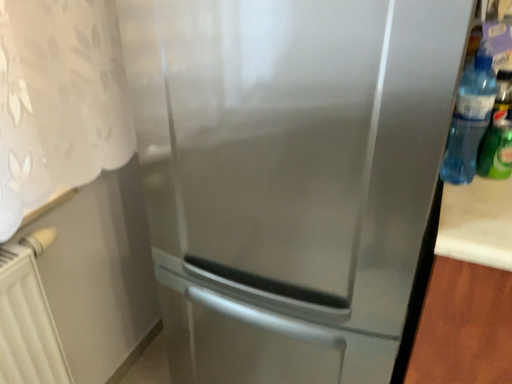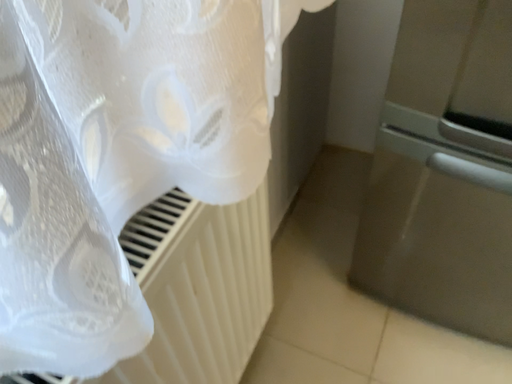
Question: How did the camera likely rotate when shooting the video?

Choices:
 (A) rotated downward
 (B) rotated upward

Answer: (A)